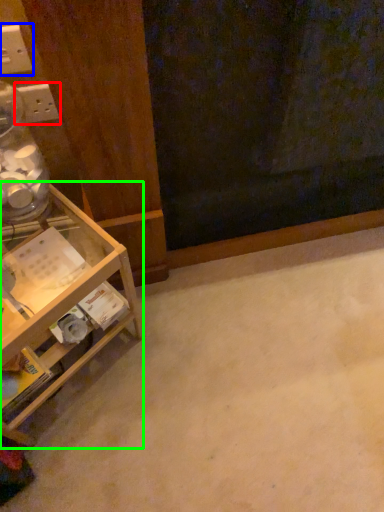
Question: Estimate the real-world distances between objects in this image. Which object is closer to electric outlet (highlighted by a red box), electric outlet (highlighted by a blue box) or shelf (highlighted by a green box)?

Choices:
 (A) electric outlet
 (B) shelf

Answer: (A)